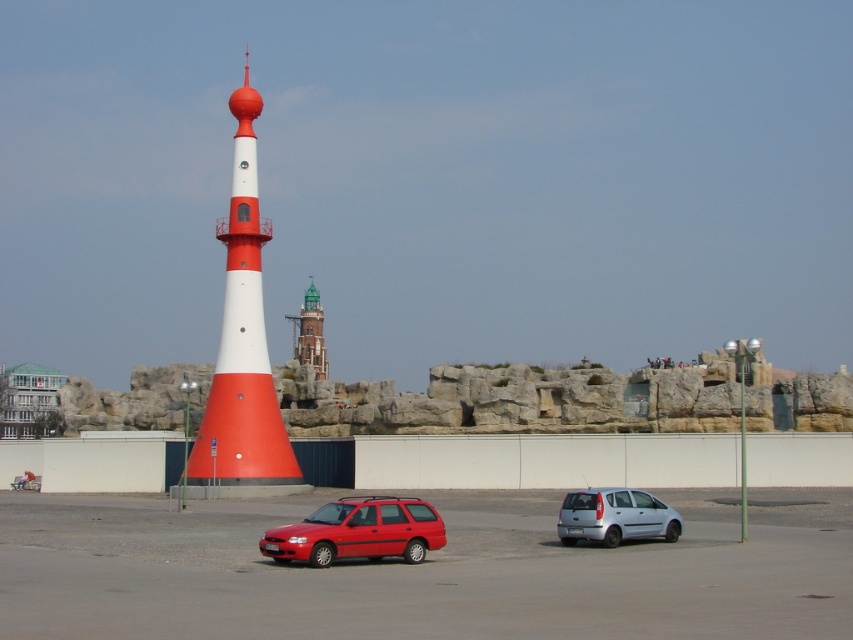
Is point (373, 499) farther from viewer compared to point (300, 328)?

No, it is not.

Identify the location of shiny red station wagon at center. (358, 531).

Is smooth asphalt parking lot at center wider than smooth orange cone at center?

Yes, smooth asphalt parking lot at center is wider than smooth orange cone at center.

Is point (251, 506) more distant than point (247, 116)?

No, (251, 506) is in front of (247, 116).

The image size is (853, 640). Identify the location of smooth asphalt parking lot at center. (421, 572).

Who is positioned more to the right, smooth asphalt parking lot at center or silver metallic hatchback at lower right?

From the viewer's perspective, silver metallic hatchback at lower right appears more on the right side.

Can you confirm if smooth asphalt parking lot at center is shorter than silver metallic hatchback at lower right?

No, smooth asphalt parking lot at center is not shorter than silver metallic hatchback at lower right.

Between point (721, 612) and point (592, 500), which one is positioned behind?

The point (592, 500) is behind.

The height and width of the screenshot is (640, 853). I want to click on smooth asphalt parking lot at center, so click(421, 572).